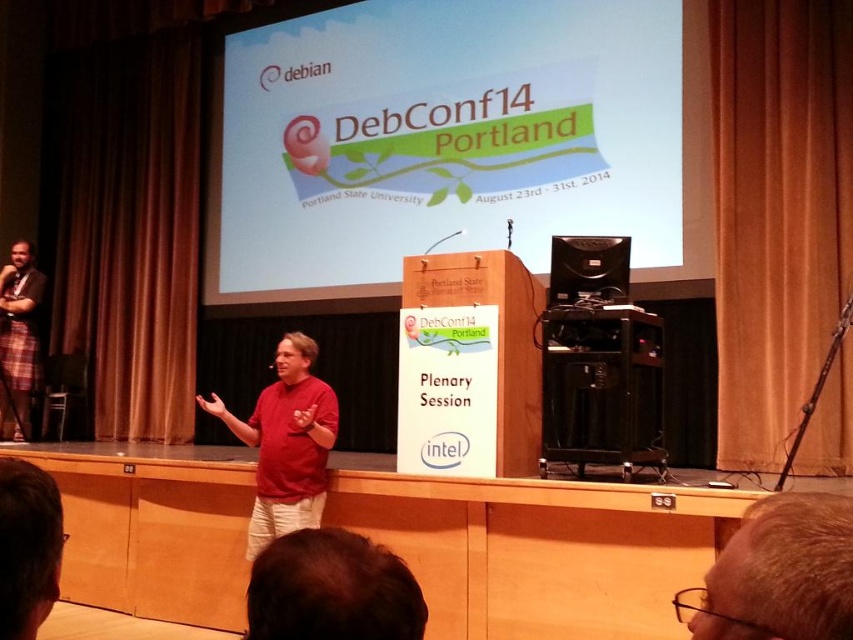
Question: Does matte wooden podium at center appear under matte red shirt at center?

Choices:
 (A) yes
 (B) no

Answer: (B)

Question: Which of the following is the closest to the observer?

Choices:
 (A) light brown hair at lower right
 (B) matte red shirt at center

Answer: (A)

Question: Which object appears closest to the camera in this image?

Choices:
 (A) matte red shirt at center
 (B) plaid fabric at left

Answer: (A)

Question: Which of these objects is positioned farthest from the matte wooden podium at center?

Choices:
 (A) plaid fabric at left
 (B) black plastic speaker at center
 (C) matte red shirt at center
 (D) light brown hair at lower right

Answer: (D)

Question: Considering the relative positions of matte wooden podium at center and plaid fabric at left in the image provided, where is matte wooden podium at center located with respect to plaid fabric at left?

Choices:
 (A) right
 (B) left

Answer: (A)

Question: Is plaid fabric at left closer to camera compared to black plastic speaker at center?

Choices:
 (A) no
 (B) yes

Answer: (A)